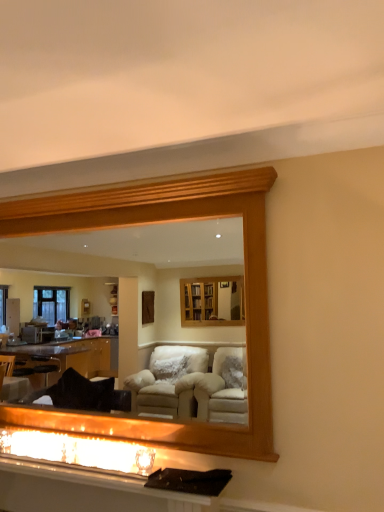
Question: Should I look upward or downward to see matte glass fireplace at lower center?

Choices:
 (A) down
 (B) up

Answer: (A)

Question: Could you tell me if matte white vanity at lower center is turned towards matte glass fireplace at lower center?

Choices:
 (A) yes
 (B) no

Answer: (B)

Question: Is matte white vanity at lower center closer to camera compared to matte glass fireplace at lower center?

Choices:
 (A) yes
 (B) no

Answer: (A)

Question: From a real-world perspective, is matte white vanity at lower center beneath matte glass fireplace at lower center?

Choices:
 (A) no
 (B) yes

Answer: (B)

Question: Can we say matte white vanity at lower center lies outside matte glass fireplace at lower center?

Choices:
 (A) yes
 (B) no

Answer: (A)

Question: Could matte glass fireplace at lower center be considered to be inside matte white vanity at lower center?

Choices:
 (A) no
 (B) yes

Answer: (A)

Question: Considering the relative sizes of matte white vanity at lower center and matte glass fireplace at lower center in the image provided, is matte white vanity at lower center wider than matte glass fireplace at lower center?

Choices:
 (A) no
 (B) yes

Answer: (B)

Question: From a real-world perspective, does wooden frame at upper center stand above matte glass fireplace at lower center?

Choices:
 (A) yes
 (B) no

Answer: (A)

Question: Considering the relative sizes of wooden frame at upper center and matte glass fireplace at lower center in the image provided, is wooden frame at upper center thinner than matte glass fireplace at lower center?

Choices:
 (A) yes
 (B) no

Answer: (A)

Question: Is wooden frame at upper center smaller than matte glass fireplace at lower center?

Choices:
 (A) no
 (B) yes

Answer: (A)

Question: Does wooden frame at upper center have a lesser height compared to matte glass fireplace at lower center?

Choices:
 (A) yes
 (B) no

Answer: (B)

Question: Can you confirm if wooden frame at upper center is wider than matte glass fireplace at lower center?

Choices:
 (A) no
 (B) yes

Answer: (A)

Question: Is wooden frame at upper center oriented towards matte glass fireplace at lower center?

Choices:
 (A) no
 (B) yes

Answer: (A)

Question: From a real-world perspective, is matte glass fireplace at lower center positioned over matte white vanity at lower center based on gravity?

Choices:
 (A) no
 (B) yes

Answer: (B)